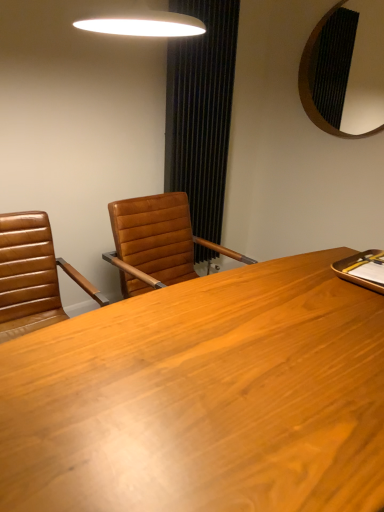
Question: Relative to brown leather chair at left, is black textured mirror at upper right in front or behind?

Choices:
 (A) front
 (B) behind

Answer: (B)

Question: Considering the positions of point pos(329,22) and point pos(0,339), is point pos(329,22) closer or farther from the camera than point pos(0,339)?

Choices:
 (A) farther
 (B) closer

Answer: (A)

Question: Estimate the real-world distances between objects in this image. Which object is farther from the wooden desk at center?

Choices:
 (A) brown leather chair at left
 (B) black textured mirror at upper right
 (C) black textured curtain at center

Answer: (B)

Question: Estimate the real-world distances between objects in this image. Which object is closer to the wooden desk at center?

Choices:
 (A) brown leather chair at left
 (B) black textured curtain at center
 (C) black textured mirror at upper right

Answer: (A)